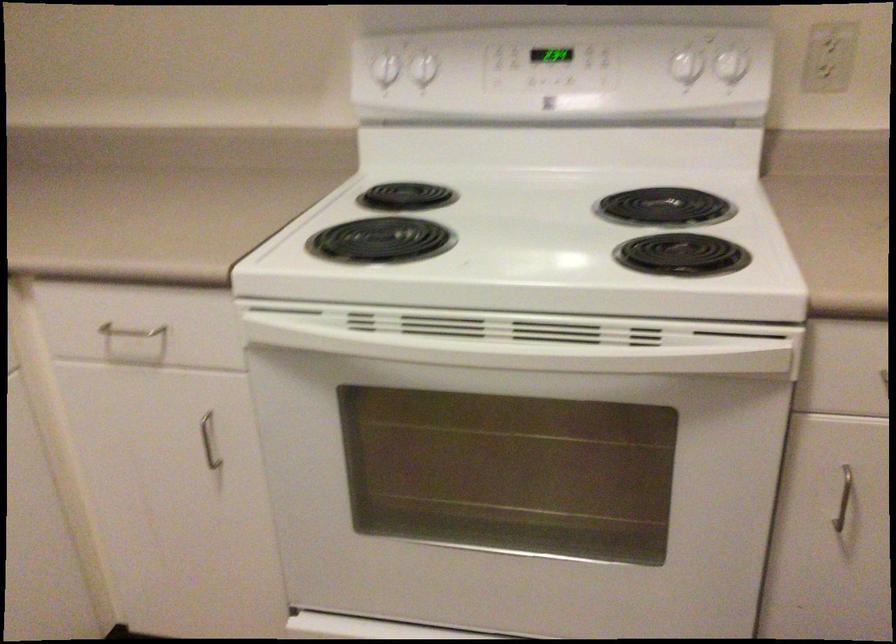
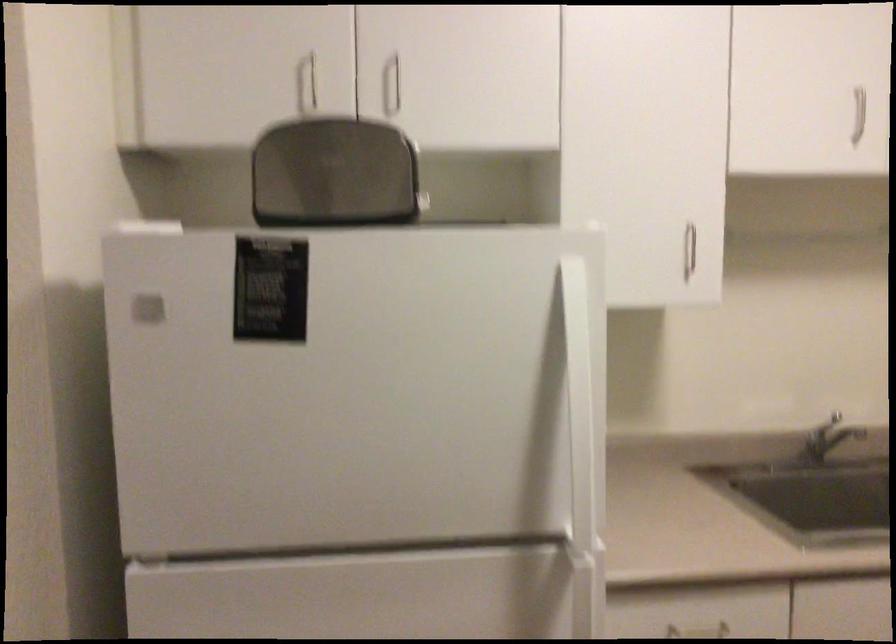
Question: How did the camera likely rotate?

Choices:
 (A) Left
 (B) Right
 (C) Up
 (D) Down

Answer: (A)